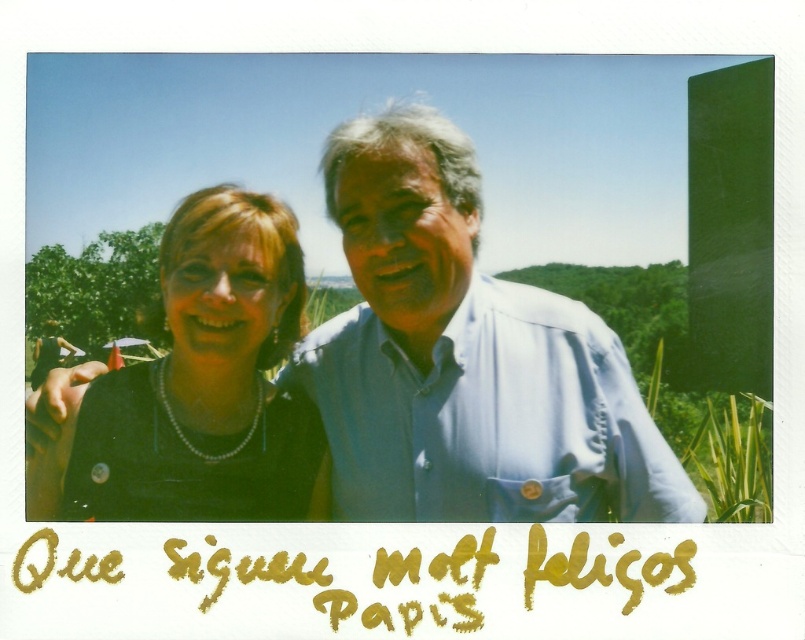
Question: Can you confirm if black matte shirt at center is wider than pearl necklace at center?

Choices:
 (A) yes
 (B) no

Answer: (A)

Question: Does black matte shirt at center appear on the right side of pearl necklace at center?

Choices:
 (A) no
 (B) yes

Answer: (B)

Question: Where is black matte shirt at center located in relation to pearl necklace at center in the image?

Choices:
 (A) left
 (B) right

Answer: (B)

Question: Which object appears farthest from the camera in this image?

Choices:
 (A) pearl necklace at center
 (B) black matte shirt at center

Answer: (A)

Question: Which point is closer to the camera taking this photo?

Choices:
 (A) (294, 284)
 (B) (514, 490)

Answer: (B)